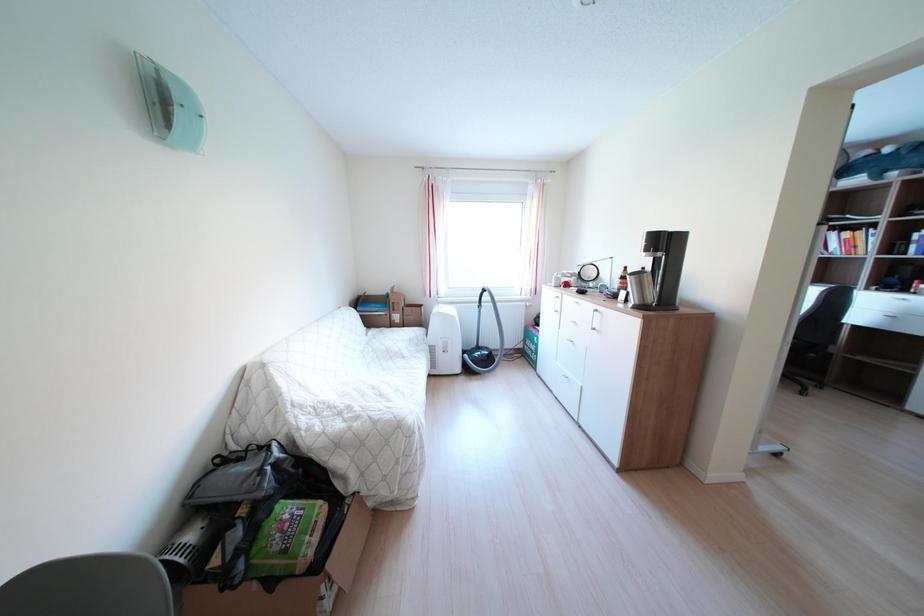
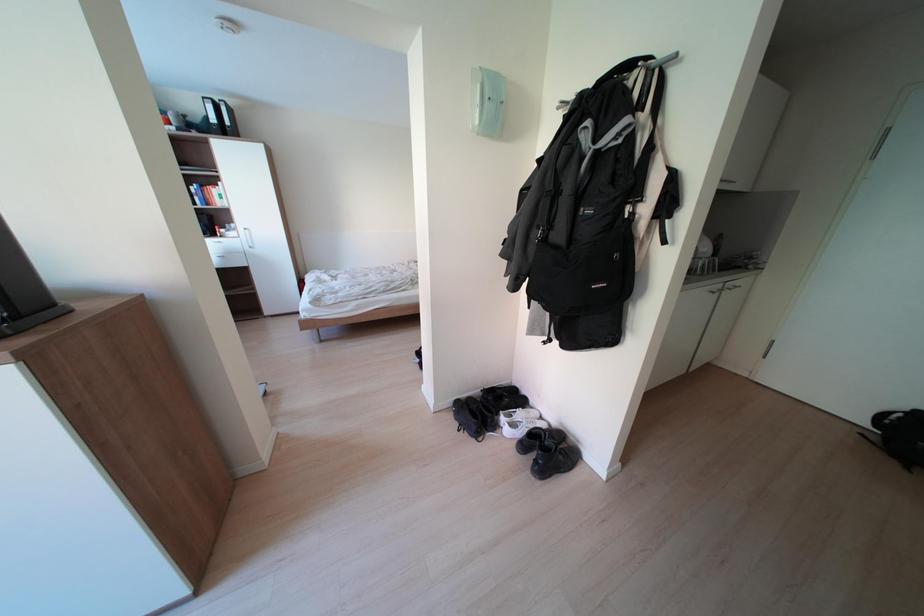
How did the camera likely rotate?

The camera rotated toward right-down.